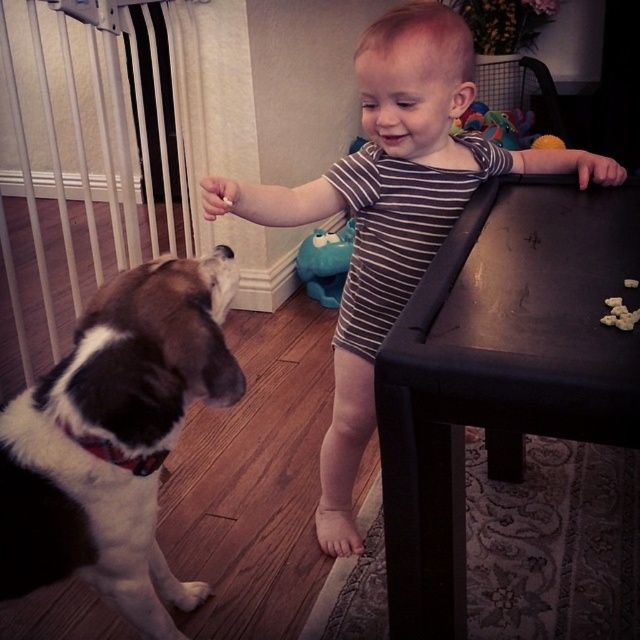
You are a parent who wants to retrieve the matte blue plush toy at center from the floor. The brown and white fur at left belongs to the dog. If the dog is currently 1.48 meters away from the toy, can you safely pick up the toy without the dog noticing?

The brown and white fur at left is 1.48 meters from matte blue plush toy at center. Since the dog is 1.48 meters away from the toy, you can safely pick up the matte blue plush toy at center as the distance is sufficient to avoid disturbing the dog.

The child is trying to place the striped cotton onesie at center on the table where the brown crumbly food at table right is located. Will the onesie fit on the table without overlapping the food?

The striped cotton onesie at center might be wider than brown crumbly food at table right, so there is a possibility that placing the onesie could overlap the food if there isn